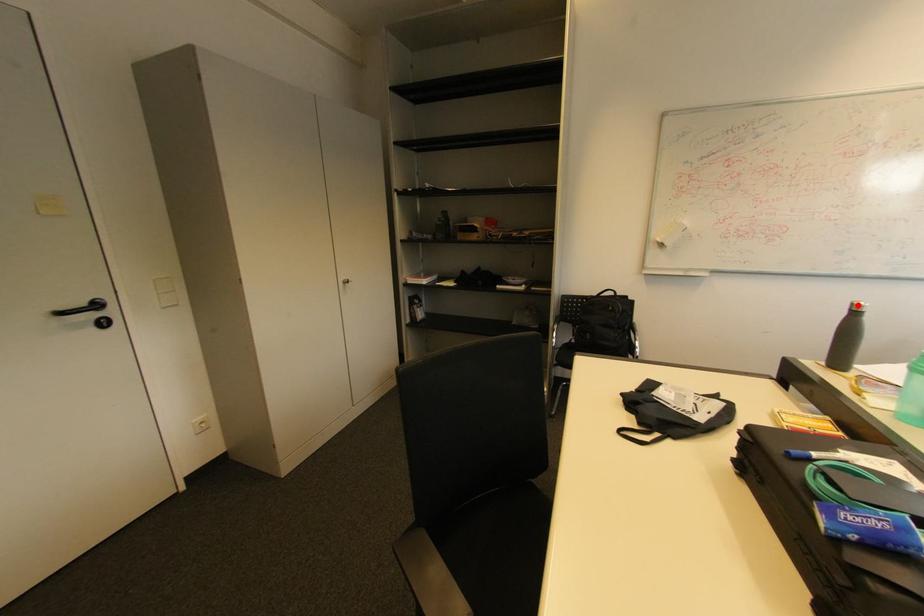
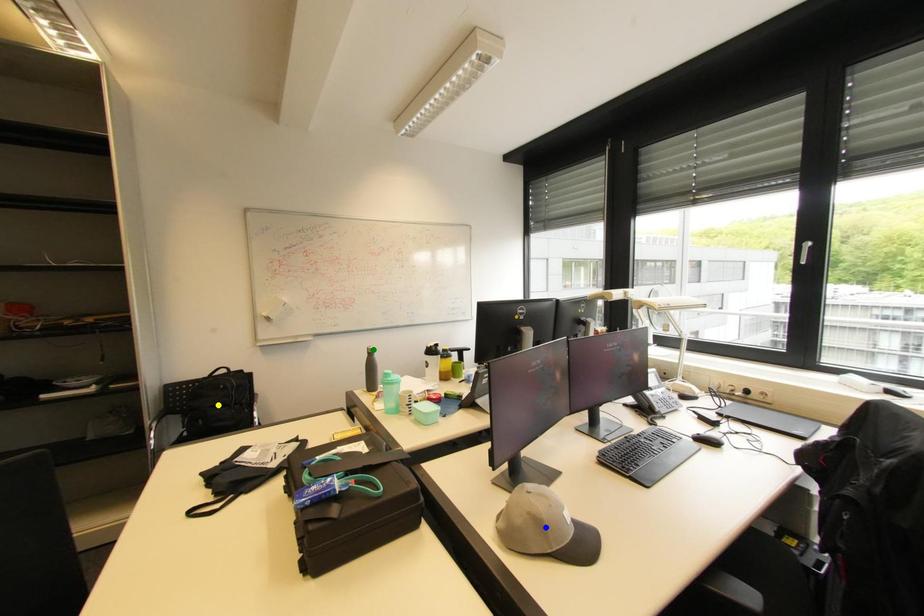
Question: I am providing you with two images of the same scene from different viewpoints. A red point is marked on the first image. You are given multiple points on the second image. Which point in image 2 represents the same 3d spot as the red point in image 1?

Choices:
 (A) green point
 (B) yellow point
 (C) blue point

Answer: (A)